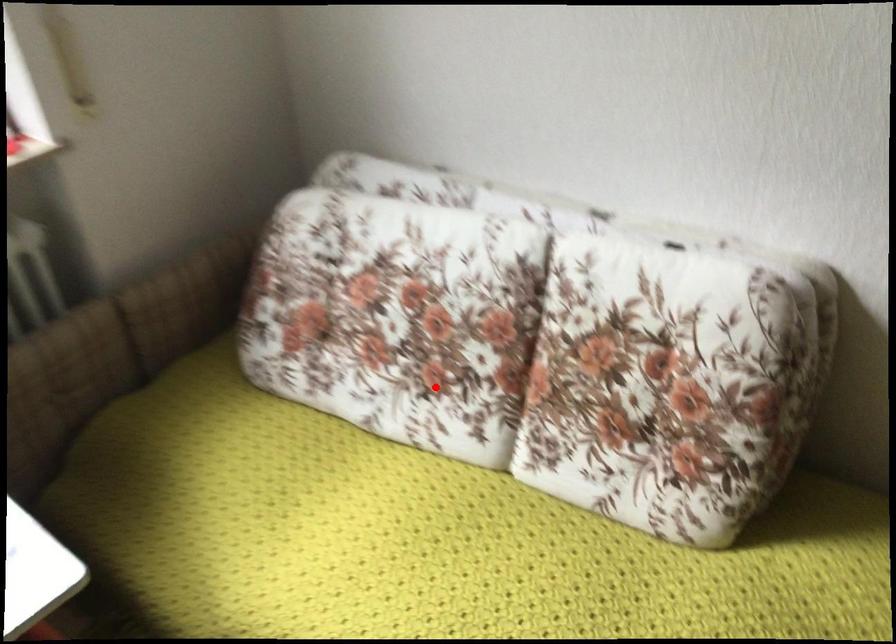
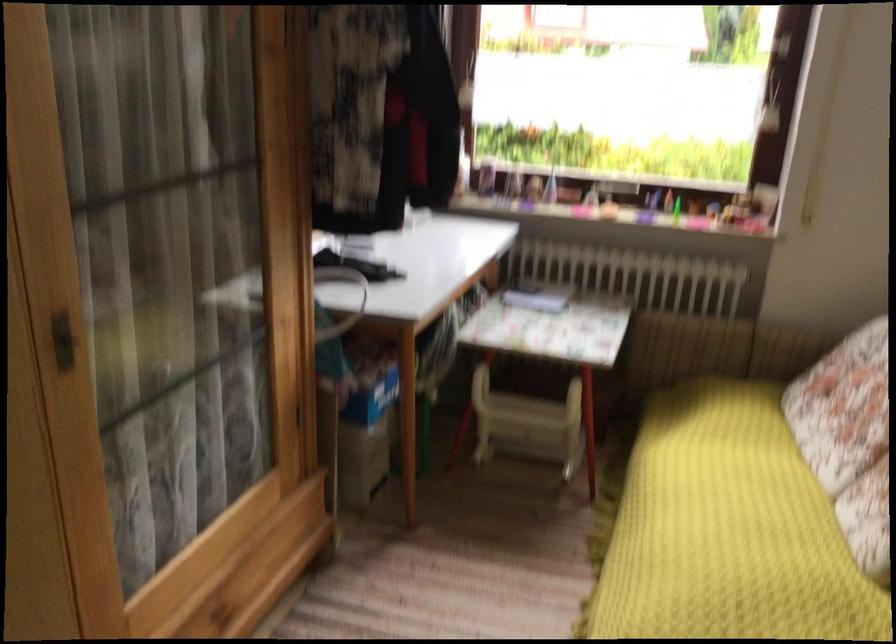
Question: I am providing you with two images of the same scene from different viewpoints. Image1 has a red point marked. In image2, the corresponding 3D location appears at what relative position? Reply with the corresponding letter.

Choices:
 (A) Closer
 (B) Farther

Answer: (B)